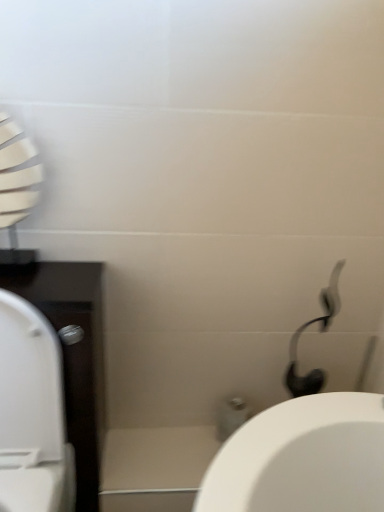
Question: From their relative heights in the image, would you say white matte shower head at upper right is taller or shorter than white glossy porcelain at center?

Choices:
 (A) tall
 (B) short

Answer: (A)

Question: From a real-world perspective, is white matte shower head at upper right positioned above or below white glossy porcelain at center?

Choices:
 (A) above
 (B) below

Answer: (A)

Question: Estimate the real-world distances between objects in this image. Which object is farther from the white matte shower head at upper right?

Choices:
 (A) white glossy porcelain at center
 (B) white glossy toilet at left

Answer: (B)

Question: Considering the real-world distances, which object is farthest from the white matte shower head at upper right?

Choices:
 (A) white glossy porcelain at center
 (B) white glossy toilet at left

Answer: (B)